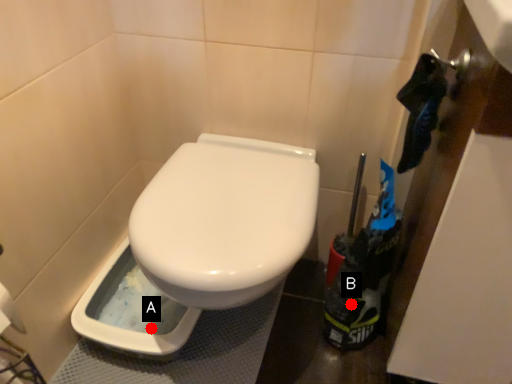
Question: Two points are circled on the image, labeled by A and B beside each circle. Which point is closer to the camera?

Choices:
 (A) A is closer
 (B) B is closer

Answer: (B)